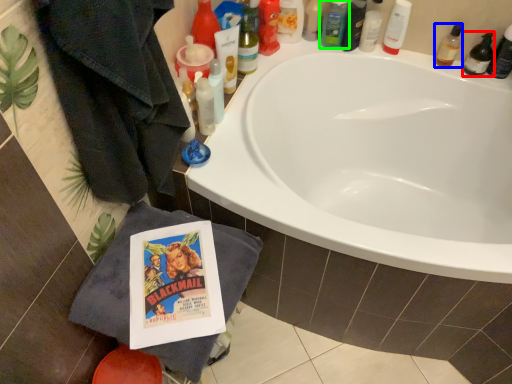
Question: Which object is the farthest from mouthwash (highlighted by a red box)? Choose among these: toiletry (highlighted by a blue box) or toiletry (highlighted by a green box).

Choices:
 (A) toiletry
 (B) toiletry

Answer: (B)